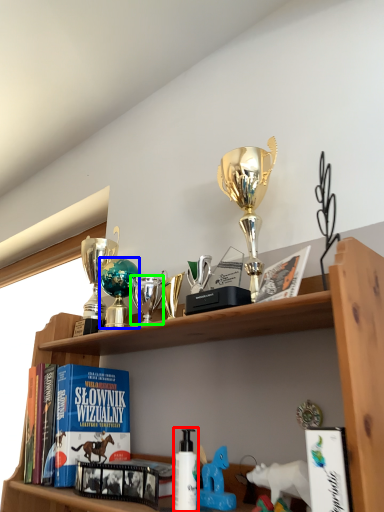
Question: Which object is the farthest from bottle (highlighted by a red box)? Choose among these: toy (highlighted by a blue box) or toy (highlighted by a green box).

Choices:
 (A) toy
 (B) toy

Answer: (A)